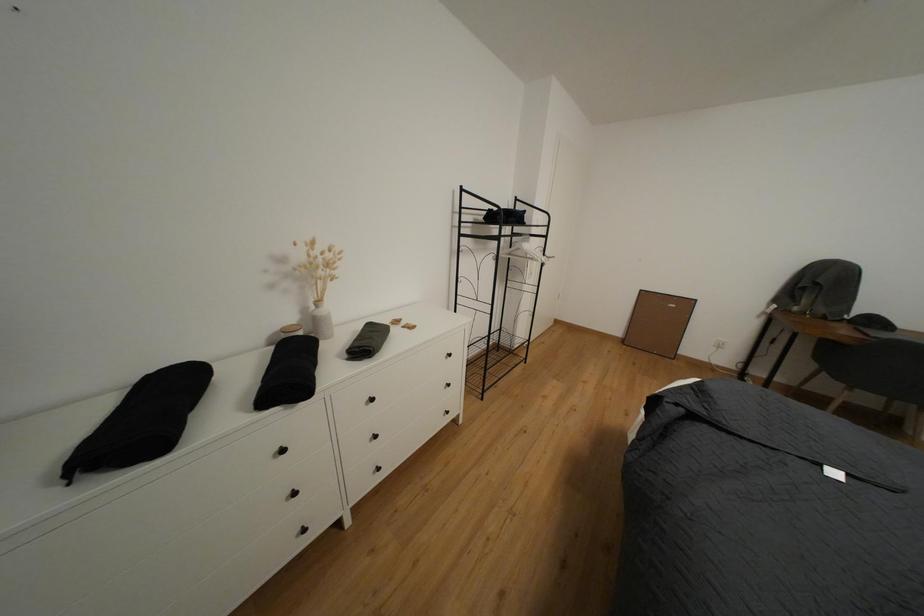
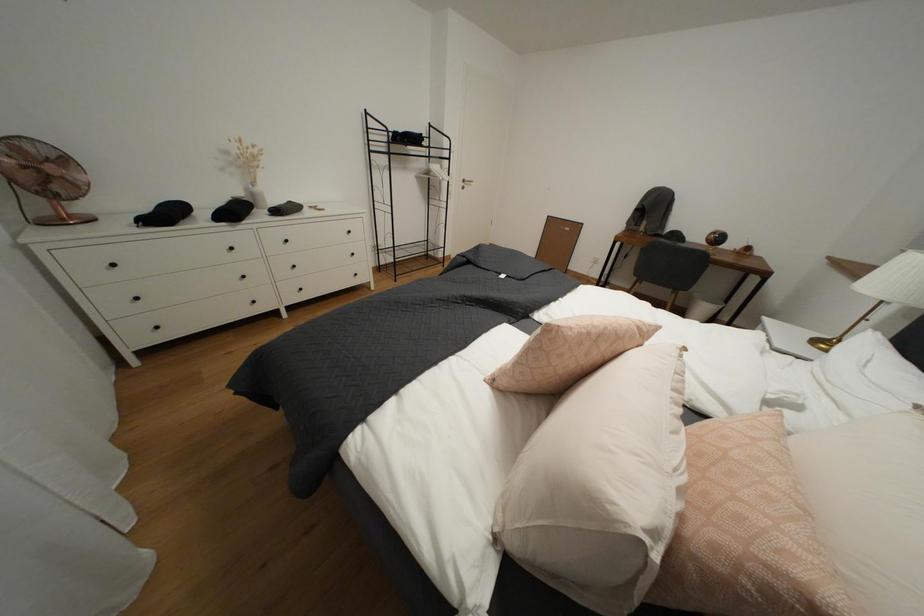
What movement of the cameraman would produce the second image?

The cameraman walked toward right, backward.